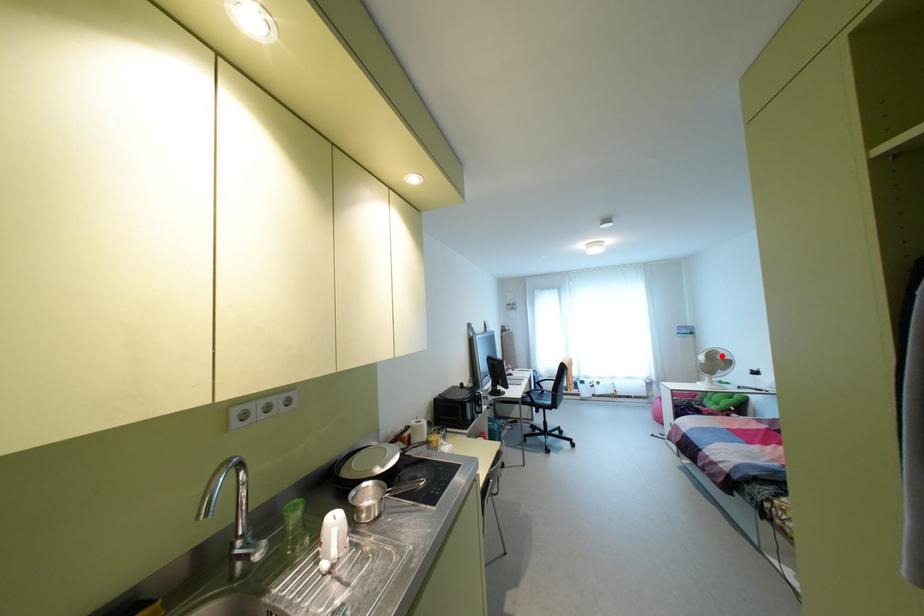
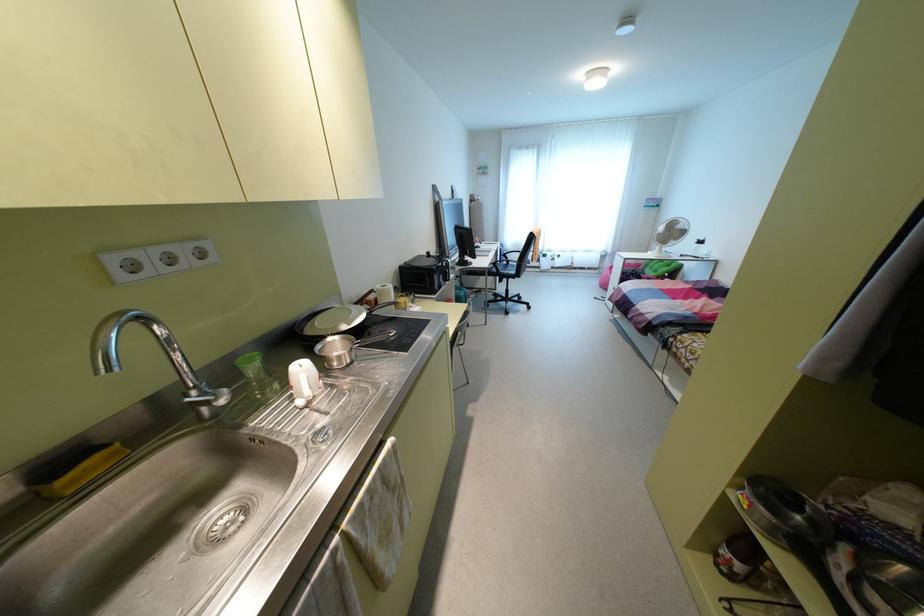
Locate, in the second image, the point that corresponds to the highlighted location in the first image.

(679, 225)